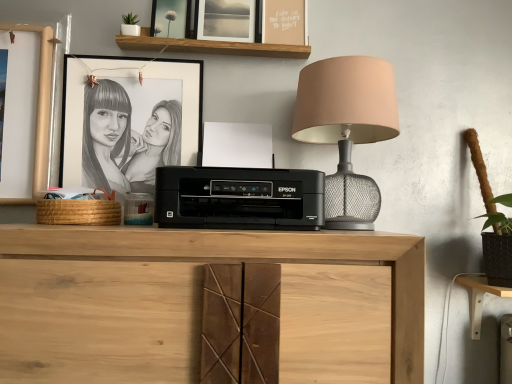
Question: Is black plastic printer at center closer to camera compared to white matte picture frame at upper center, acting as the third picture frame starting from the bottom?

Choices:
 (A) no
 (B) yes

Answer: (B)

Question: Would you say white matte picture frame at upper center, acting as the third picture frame starting from the bottom, is part of black plastic printer at center's contents?

Choices:
 (A) yes
 (B) no

Answer: (B)

Question: Is black plastic printer at center not near white matte picture frame at upper center, acting as the third picture frame starting from the bottom?

Choices:
 (A) yes
 (B) no

Answer: (B)

Question: Is black plastic printer at center aimed at white matte picture frame at upper center, the first picture frame viewed from the top?

Choices:
 (A) no
 (B) yes

Answer: (A)

Question: Is black plastic printer at center beside white matte picture frame at upper center, the first picture frame viewed from the top?

Choices:
 (A) yes
 (B) no

Answer: (B)

Question: From a real-world perspective, relative to black paper picture frame at upper left, the third picture frame when ordered from top to bottom, is black plastic printer at center vertically above or below?

Choices:
 (A) above
 (B) below

Answer: (B)

Question: Does point (321, 198) appear closer or farther from the camera than point (72, 155)?

Choices:
 (A) closer
 (B) farther

Answer: (A)

Question: Considering their positions, is black plastic printer at center located in front of or behind black paper picture frame at upper left, the 1th picture frame ordered from the bottom?

Choices:
 (A) behind
 (B) front

Answer: (B)

Question: Is black plastic printer at center inside the boundaries of black paper picture frame at upper left, the third picture frame when ordered from top to bottom, or outside?

Choices:
 (A) inside
 (B) outside

Answer: (B)

Question: Is black paper picture frame at upper left, the third picture frame when ordered from top to bottom, spatially inside natural wood cabinet at center, or outside of it?

Choices:
 (A) outside
 (B) inside

Answer: (A)

Question: In terms of width, does black paper picture frame at upper left, the third picture frame when ordered from top to bottom, look wider or thinner when compared to natural wood cabinet at center?

Choices:
 (A) thin
 (B) wide

Answer: (A)

Question: Would you say black paper picture frame at upper left, the third picture frame when ordered from top to bottom, is to the left or to the right of natural wood cabinet at center in the picture?

Choices:
 (A) left
 (B) right

Answer: (A)

Question: Considering their positions, is black paper picture frame at upper left, the third picture frame when ordered from top to bottom, located in front of or behind natural wood cabinet at center?

Choices:
 (A) behind
 (B) front

Answer: (A)

Question: Would you say light wood computer desk at lower right is to the left or to the right of matte glass picture frame at upper center, which is counted as the 2th picture frame, starting from the bottom, in the picture?

Choices:
 (A) right
 (B) left

Answer: (A)

Question: Is light wood computer desk at lower right taller or shorter than matte glass picture frame at upper center, acting as the second picture frame starting from the top?

Choices:
 (A) short
 (B) tall

Answer: (B)